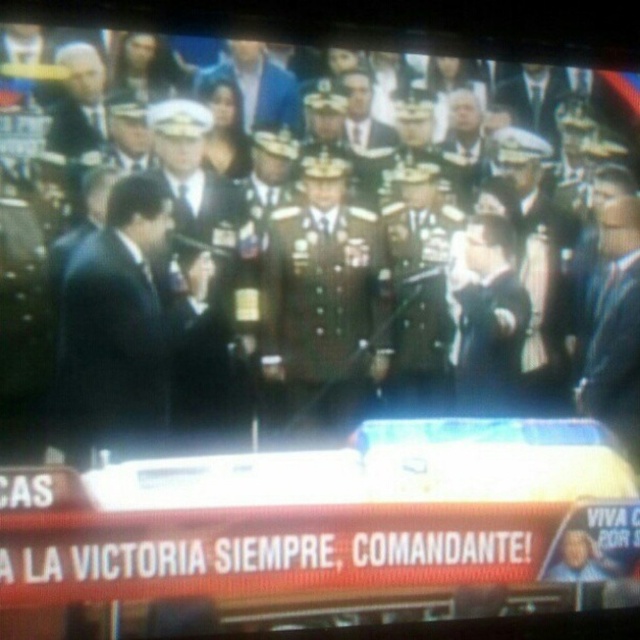
Question: Is black matte suit at left below shiny gold uniform at center?

Choices:
 (A) yes
 (B) no

Answer: (A)

Question: Which object is closer to the camera taking this photo?

Choices:
 (A) satin blue suit at right
 (B) black matte suit at left
 (C) blue fabric jacket at center
 (D) shiny gold uniform at center

Answer: (B)

Question: Considering the real-world distances, which object is farthest from the shiny gold uniform at center?

Choices:
 (A) blue fabric jacket at center
 (B) satin blue suit at right

Answer: (B)

Question: Which object is the closest to the shiny gold uniform at center?

Choices:
 (A) black matte suit at left
 (B) blue fabric jacket at center
 (C) satin blue suit at right

Answer: (B)

Question: Does satin blue suit at right have a lesser width compared to blue fabric jacket at center?

Choices:
 (A) yes
 (B) no

Answer: (A)

Question: Does shiny gold uniform at center lie behind blue fabric jacket at center?

Choices:
 (A) no
 (B) yes

Answer: (B)